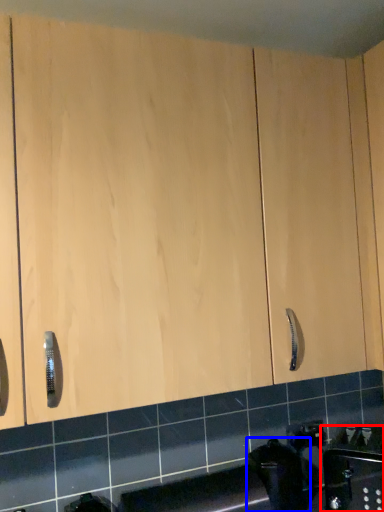
Question: Among these objects, which one is nearest to the camera, sink (highlighted by a red box) or appliance (highlighted by a blue box)?

Choices:
 (A) sink
 (B) appliance

Answer: (A)